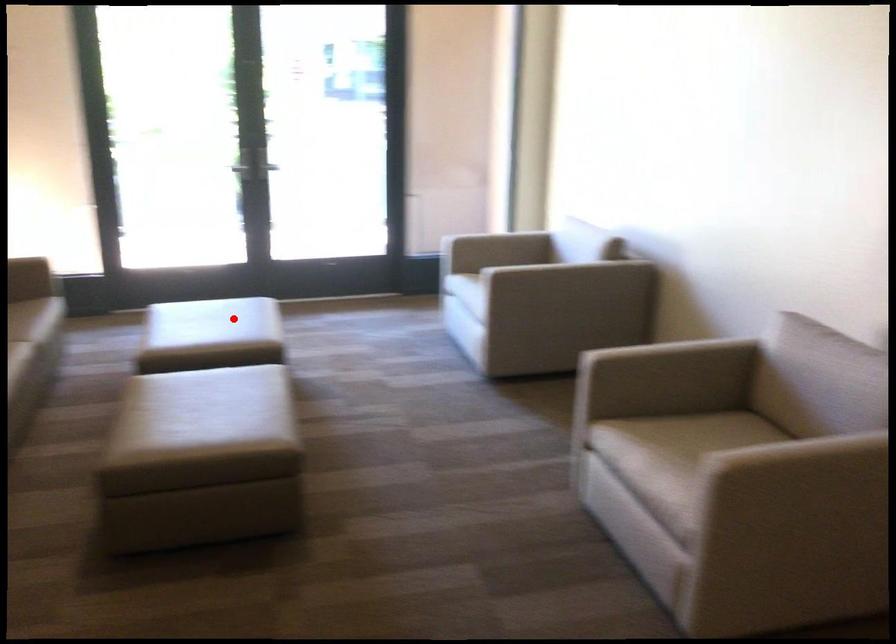
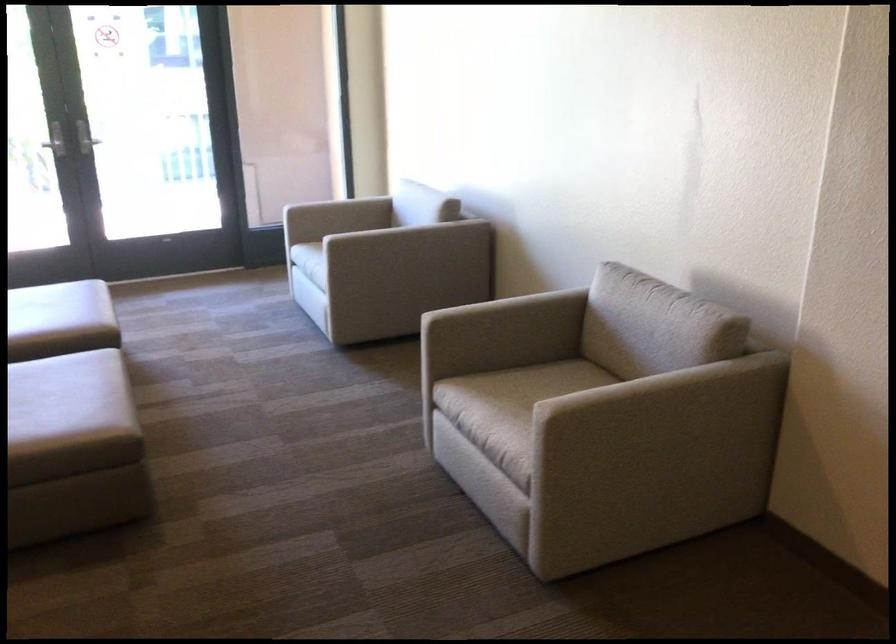
Find the pixel in the second image that matches the highlighted location in the first image.

(58, 308)